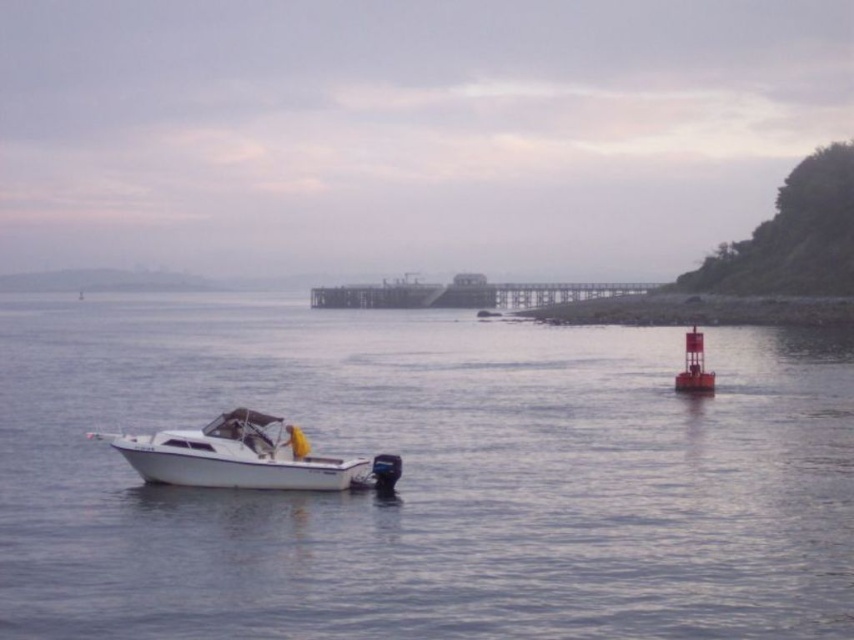
You are standing on the beach and see the white glossy boat at lower left and the white smooth water at center. How far apart are they?

The white smooth water at center is 15.05 meters away from the white glossy boat at lower left.

You are standing on the wooden pier at center and want to get to the white smooth water at center. Can you step directly onto the water from the pier?

The white smooth water at center is closer to the viewer than the wooden pier at center, so stepping onto the water from the pier is not possible because the pier is farther away and the water is in front of it.